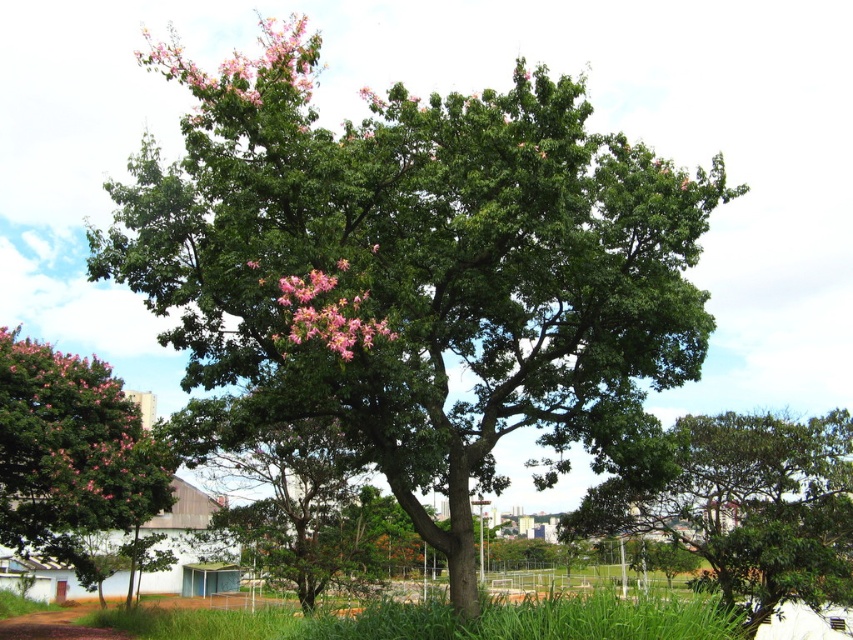
Question: Considering the real-world distances, which object is farthest from the pink matte flowers at upper left?

Choices:
 (A) green grass at lower center
 (B) green glossy tree at center

Answer: (B)

Question: From the image, what is the correct spatial relationship of pink matte flowers at upper left in relation to pink matte flowers at center?

Choices:
 (A) below
 (B) above

Answer: (B)

Question: Is pink glossy tree at left positioned before pink matte flowers at center?

Choices:
 (A) no
 (B) yes

Answer: (A)

Question: From the image, what is the correct spatial relationship of pink glossy tree at left in relation to pink matte flowers at upper left?

Choices:
 (A) left
 (B) right

Answer: (A)

Question: Among these objects, which one is nearest to the camera?

Choices:
 (A) green grass at lower center
 (B) pink matte flowers at center
 (C) pink glossy tree at left

Answer: (B)

Question: Which point is closer to the camera?

Choices:
 (A) (718, 570)
 (B) (264, 72)

Answer: (B)